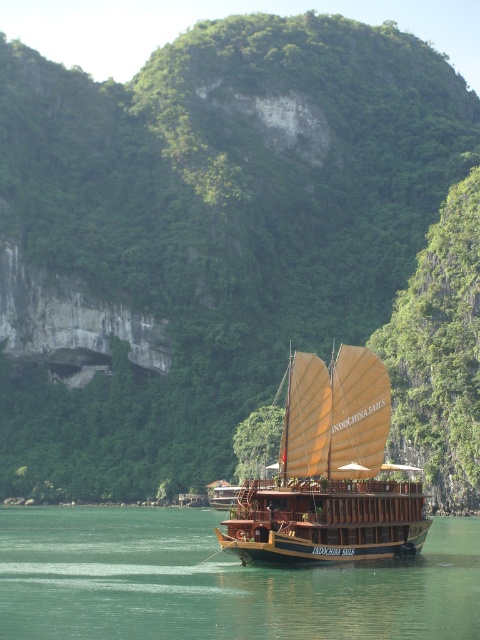
Question: Among these points, which one is farthest from the camera?

Choices:
 (A) (237, 506)
 (B) (356, 632)

Answer: (A)

Question: Can you confirm if green water at boat right is smaller than wooden sailboat at center?

Choices:
 (A) yes
 (B) no

Answer: (B)

Question: Is green water at boat right behind wooden sailboat at center?

Choices:
 (A) no
 (B) yes

Answer: (A)

Question: Is green water at boat right thinner than wooden sailboat at center?

Choices:
 (A) no
 (B) yes

Answer: (A)